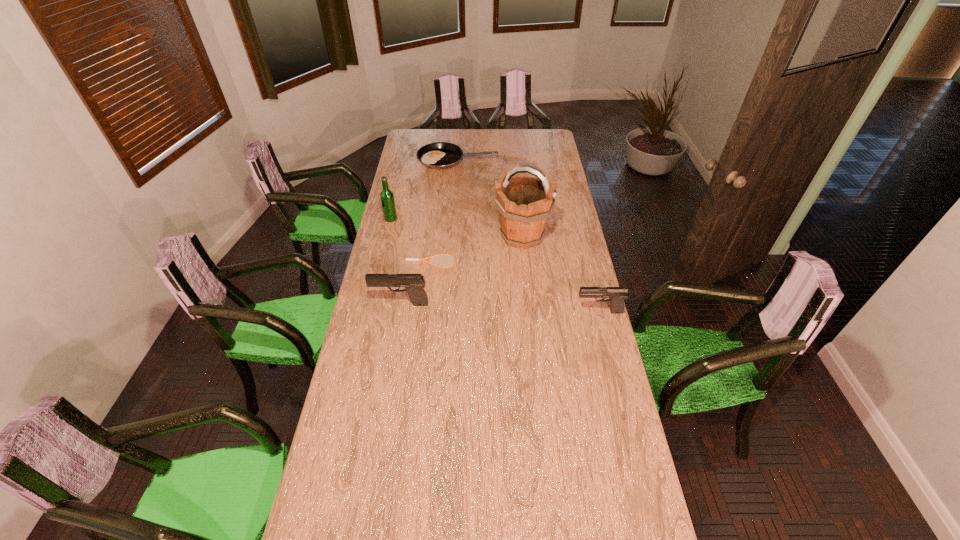
To achieve uniform spacing by inserting another pistol among them, please point to a free space for this new pistol. Please provide its 2D coordinates. Your answer should be formatted as a tuple, i.e. [(x, y)], where the tuple contains the x and y coordinates of a point satisfying the conditions above.

[(499, 308)]